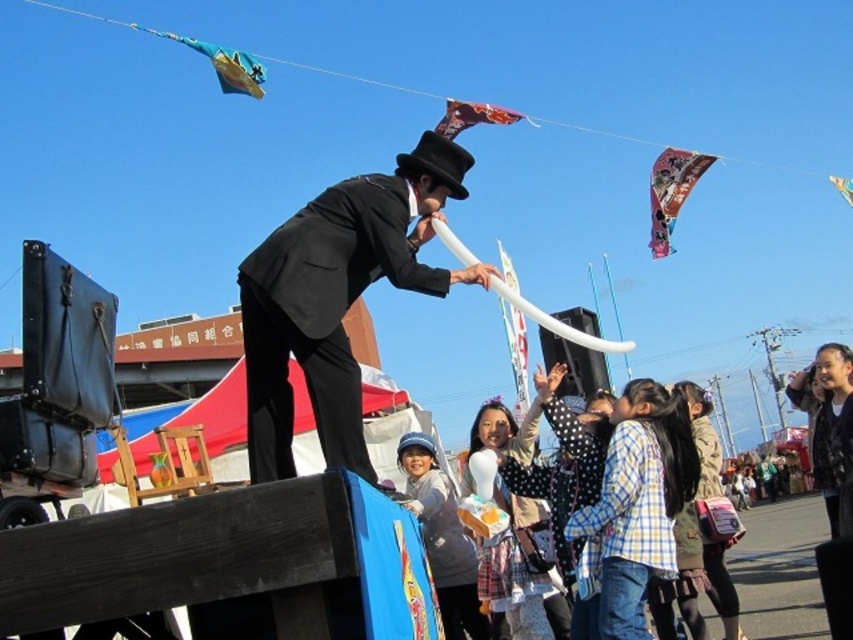
Is point (276, 422) farther from camera compared to point (703, 163)?

That is False.

Does shiny black suit at center appear over multicolored paper kite at upper right?

No, shiny black suit at center is not above multicolored paper kite at upper right.

This screenshot has height=640, width=853. I want to click on shiny black suit at center, so click(x=337, y=298).

Can you confirm if shiny black suit at center is smaller than printed fabric kite at upper center?

Yes, shiny black suit at center is smaller than printed fabric kite at upper center.

You are a GUI agent. You are given a task and a screenshot of the screen. Output one action in this format:
    pyautogui.click(x=<x>, y=<y>)
    Task: Click on the shiny black suit at center
    
    Given the screenshot: What is the action you would take?
    pyautogui.click(x=337, y=298)

Where is `shiny black suit at center`? This screenshot has height=640, width=853. shiny black suit at center is located at coordinates (337, 298).

Who is more distant from viewer, (318, 243) or (784, 472)?

The point (784, 472) is more distant.

Identify the location of shiny black suit at center. This screenshot has height=640, width=853. (337, 298).